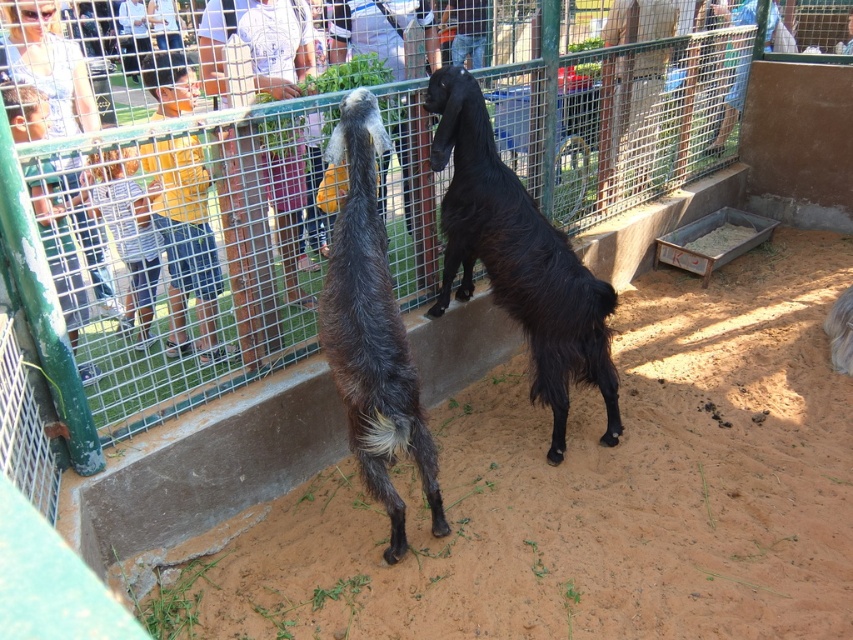
You are a small animal trying to cross from the left side of the scene to the right side. You need to avoid obstacles taller than you. The brown sandy dirt at center and the dark brown fur goat at center are in your path. Which one can you safely walk over?

The brown sandy dirt at center is shorter than the dark brown fur goat at center, so you can safely walk over the brown sandy dirt at center.

You are standing in front of the goats at the petting zoo. There are two points marked in the scene. One is at coordinates point (671, 456) and the other at point (416, 394). Which point is closer to you?

Point (416, 394) is closer to you because it is less further than point (671, 456).